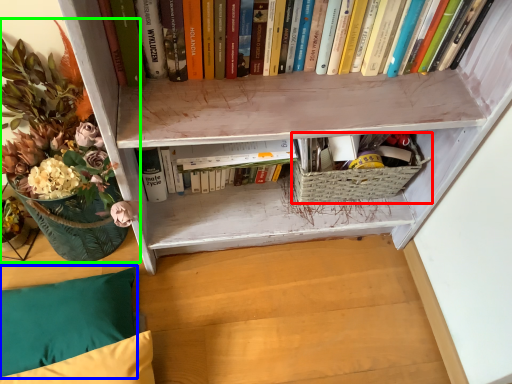
Question: Estimate the real-world distances between objects in this image. Which object is closer to basket (highlighted by a red box), pillow (highlighted by a blue box) or floral arrangement (highlighted by a green box)?

Choices:
 (A) pillow
 (B) floral arrangement

Answer: (B)